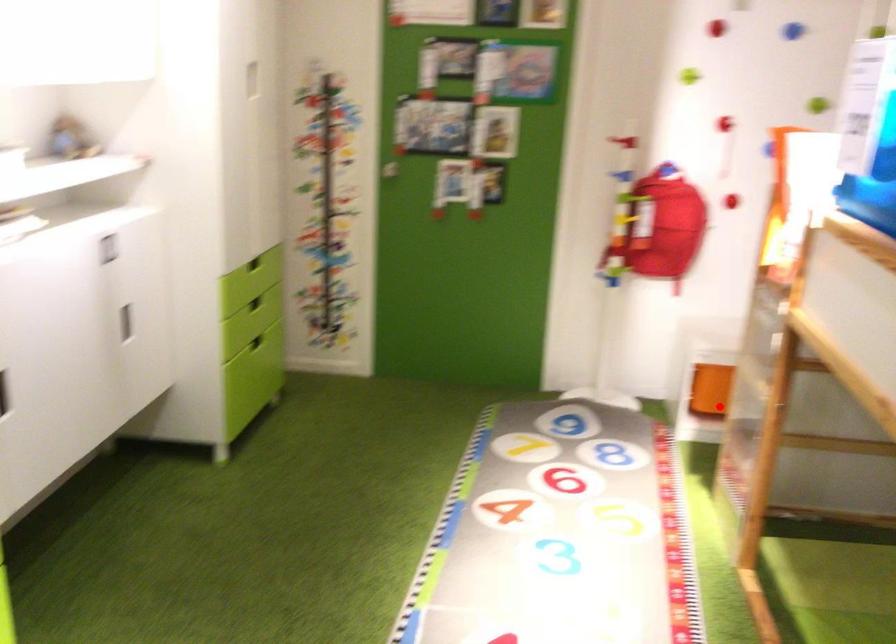
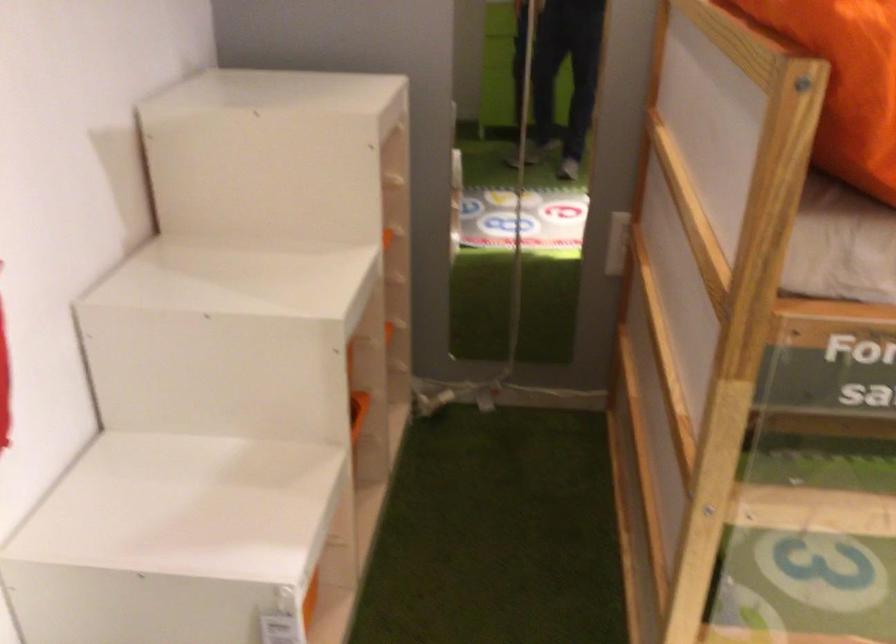
In the second image, find the point that corresponds to the highlighted location in the first image.

(309, 600)